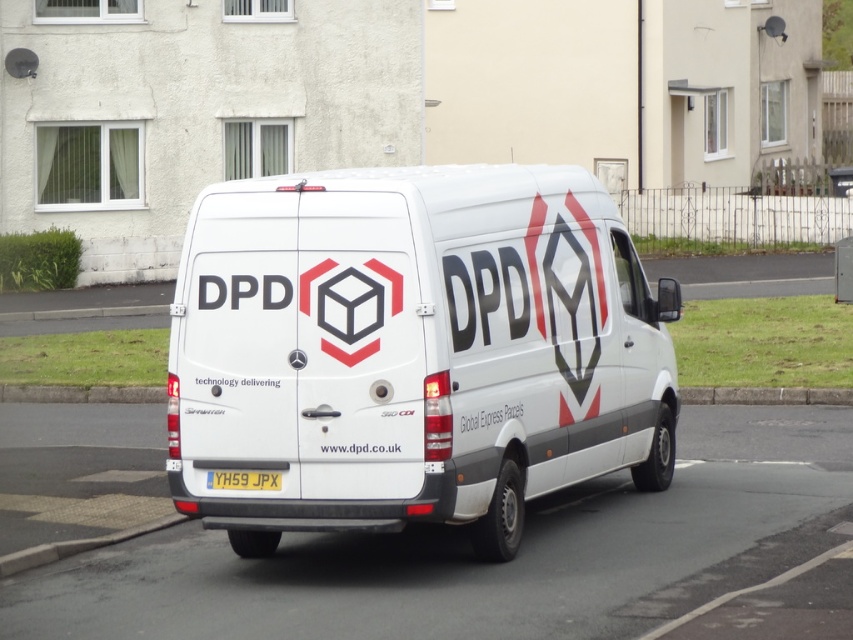
Which is more to the left, white matte van at center or yellow matte license plate at center?

Positioned to the left is yellow matte license plate at center.

In the scene shown: Who is positioned more to the right, white matte van at center or yellow matte license plate at center?

From the viewer's perspective, white matte van at center appears more on the right side.

Image resolution: width=853 pixels, height=640 pixels. What do you see at coordinates (412, 349) in the screenshot?
I see `white matte van at center` at bounding box center [412, 349].

Find the location of a particular element. This screenshot has height=640, width=853. white matte van at center is located at coordinates (412, 349).